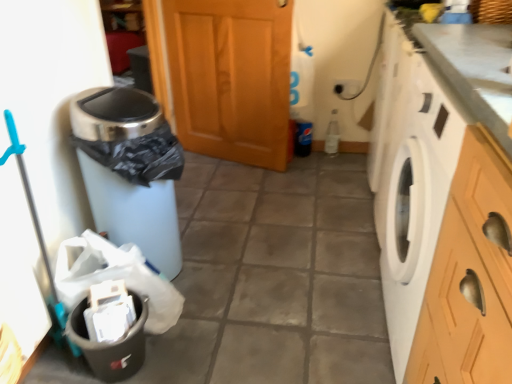
This screenshot has width=512, height=384. What do you see at coordinates (115, 277) in the screenshot? I see `black plastic trash can at left` at bounding box center [115, 277].

This screenshot has width=512, height=384. Describe the element at coordinates (128, 171) in the screenshot. I see `matte plastic trash can at left` at that location.

What do you see at coordinates (111, 343) in the screenshot? The height and width of the screenshot is (384, 512). I see `black plastic recycling bin at lower left` at bounding box center [111, 343].

The image size is (512, 384). In order to click on black plastic trash can at left in this screenshot , I will do `click(115, 277)`.

Locate an element on the screen. This screenshot has width=512, height=384. waste container lying on the right of black plastic trash can at left is located at coordinates pyautogui.click(x=128, y=171).

In the scene shown: Visually, is matte plastic trash can at left positioned to the left or to the right of black plastic trash can at left?

Based on their positions, matte plastic trash can at left is located to the right of black plastic trash can at left.

Which of these two, matte plastic trash can at left or black plastic trash can at left, is thinner?

With smaller width is black plastic trash can at left.

Is matte plastic trash can at left aimed at black plastic trash can at left?

No, matte plastic trash can at left is not turned towards black plastic trash can at left.

Is matte plastic trash can at left inside or outside of black plastic recycling bin at lower left?

matte plastic trash can at left is not inside black plastic recycling bin at lower left, it's outside.

Is matte plastic trash can at left in front of or behind black plastic recycling bin at lower left in the image?

In the image, matte plastic trash can at left appears behind black plastic recycling bin at lower left.

Is black plastic recycling bin at lower left at the back of matte plastic trash can at left?

No, matte plastic trash can at left is not facing the opposite direction of black plastic recycling bin at lower left.

You are a GUI agent. You are given a task and a screenshot of the screen. Output one action in this format:
    pyautogui.click(x=<x>, y=<y>)
    Task: Click on the waste container on the left side of black plastic recycling bin at lower left
    The image size is (512, 384).
    Given the screenshot: What is the action you would take?
    pyautogui.click(x=128, y=171)

Who is bigger, white glossy washing machine at right or wooden door at center?

With larger size is white glossy washing machine at right.

How far apart are white glossy washing machine at right and wooden door at center?

white glossy washing machine at right is 38.98 inches away from wooden door at center.

Which is more to the right, white glossy washing machine at right or wooden door at center?

Positioned to the right is white glossy washing machine at right.

Which is behind, point (448, 162) or point (213, 63)?

The point (213, 63) is farther.

The image size is (512, 384). Find the location of `waste container that is above the black plastic recycling bin at lower left (from the image's perspective)`. waste container that is above the black plastic recycling bin at lower left (from the image's perspective) is located at coordinates (128, 171).

From the picture: Between black plastic recycling bin at lower left and matte plastic trash can at left, which one appears on the left side from the viewer's perspective?

Positioned to the left is matte plastic trash can at left.

From the picture: Considering the relative sizes of black plastic recycling bin at lower left and matte plastic trash can at left in the image provided, is black plastic recycling bin at lower left thinner than matte plastic trash can at left?

Yes, black plastic recycling bin at lower left is thinner than matte plastic trash can at left.

Which is behind, black plastic recycling bin at lower left or matte plastic trash can at left?

matte plastic trash can at left is more distant.

Could you tell me if black plastic recycling bin at lower left is facing white glossy washing machine at right?

Yes, black plastic recycling bin at lower left faces towards white glossy washing machine at right.

From a real-world perspective, which is physically above, black plastic recycling bin at lower left or white glossy washing machine at right?

white glossy washing machine at right is physically above.

Where is `washing machine lying in front of the black plastic recycling bin at lower left`? washing machine lying in front of the black plastic recycling bin at lower left is located at coordinates (414, 190).

Is black plastic recycling bin at lower left not within white glossy washing machine at right?

Yes, black plastic recycling bin at lower left is located beyond the bounds of white glossy washing machine at right.

Is white glossy washing machine at right facing towards black plastic trash can at left?

Yes.

Which object is more forward, white glossy washing machine at right or black plastic trash can at left?

Positioned in front is white glossy washing machine at right.

From a real-world perspective, between white glossy washing machine at right and black plastic trash can at left, who is vertically lower?

black plastic trash can at left.

Which of these two, white glossy washing machine at right or black plastic trash can at left, stands shorter?

black plastic trash can at left is shorter.

Is matte plastic trash can at left spatially inside wooden door at center, or outside of it?

The correct answer is: outside.

Does matte plastic trash can at left have a greater height compared to wooden door at center?

No.

Are matte plastic trash can at left and wooden door at center located far from each other?

Absolutely, matte plastic trash can at left is distant from wooden door at center.

The width and height of the screenshot is (512, 384). I want to click on material lying below the matte plastic trash can at left (from the image's perspective), so click(x=115, y=277).

Identify the location of waste container behind the black plastic recycling bin at lower left. This screenshot has height=384, width=512. (128, 171).

Based on their spatial positions, is white glossy washing machine at right or matte plastic trash can at left further from black plastic recycling bin at lower left?

Among the two, white glossy washing machine at right is located further to black plastic recycling bin at lower left.

From the picture: Looking at the image, which one is located further to white glossy washing machine at right, wooden door at center or black plastic trash can at left?

wooden door at center lies further to white glossy washing machine at right than the other object.

When comparing their distances from black plastic trash can at left, does black plastic recycling bin at lower left or matte plastic trash can at left seem closer?

black plastic recycling bin at lower left is positioned closer to the anchor black plastic trash can at left.

Looking at the image, which one is located closer to wooden door at center, matte plastic trash can at left or black plastic trash can at left?

matte plastic trash can at left lies closer to wooden door at center than the other object.

When comparing their distances from white glossy washing machine at right, does matte plastic trash can at left or wooden door at center seem further?

wooden door at center is positioned further to the anchor white glossy washing machine at right.

Based on their spatial positions, is black plastic trash can at left or black plastic recycling bin at lower left closer to matte plastic trash can at left?

black plastic trash can at left is closer to matte plastic trash can at left.

From the picture: When comparing their distances from black plastic trash can at left, does wooden door at center or white glossy washing machine at right seem further?

wooden door at center is further to black plastic trash can at left.

When comparing their distances from black plastic recycling bin at lower left, does wooden door at center or matte plastic trash can at left seem further?

wooden door at center is positioned further to the anchor black plastic recycling bin at lower left.

Where is `material located between white glossy washing machine at right and wooden door at center in the depth direction`? material located between white glossy washing machine at right and wooden door at center in the depth direction is located at coordinates (115, 277).

Identify the location of recycling bin situated between black plastic trash can at left and white glossy washing machine at right from left to right. (111, 343).

In order to click on waste container that lies between wooden door at center and black plastic recycling bin at lower left from top to bottom in this screenshot , I will do `click(128, 171)`.

At what (x,y) coordinates should I click in order to perform the action: click on waste container that lies between wooden door at center and black plastic trash can at left from top to bottom. Please return your answer as a coordinate pair (x, y). Looking at the image, I should click on (128, 171).